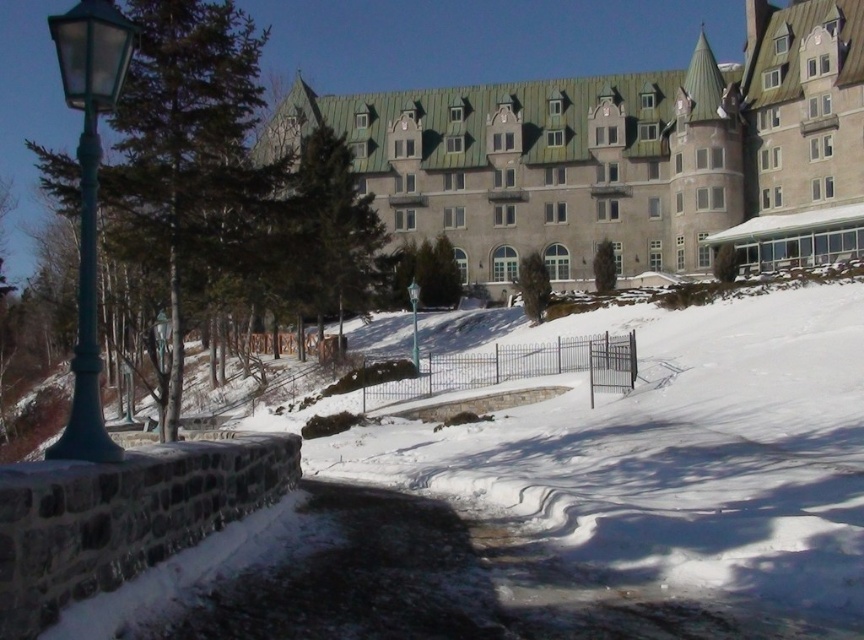
Question: Observing the image, what is the correct spatial positioning of gray stone hotel at center in reference to green glass lamp post at left?

Choices:
 (A) above
 (B) below

Answer: (A)

Question: Which point is closer to the camera taking this photo?

Choices:
 (A) (84, 422)
 (B) (500, 172)

Answer: (A)

Question: Can you confirm if gray stone hotel at center is positioned below green glass lamp post at left?

Choices:
 (A) yes
 (B) no

Answer: (B)

Question: Is gray stone hotel at center to the right of green glass lamp post at left from the viewer's perspective?

Choices:
 (A) yes
 (B) no

Answer: (A)

Question: Which object appears farthest from the camera in this image?

Choices:
 (A) green glass lamp post at left
 (B) gray stone hotel at center

Answer: (B)